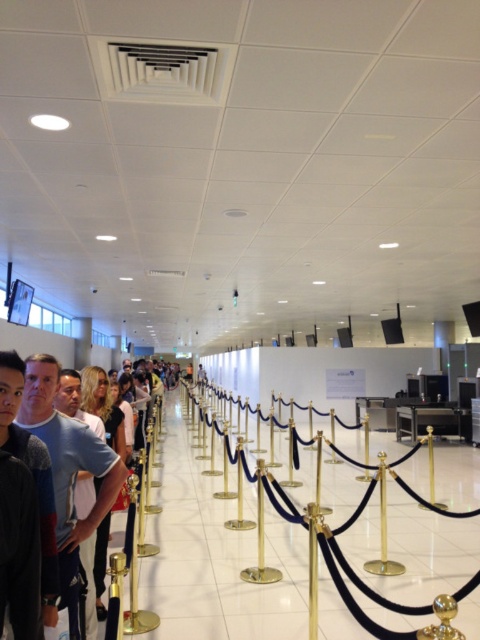
You are standing in the airport corridor and see two points marked on the floor. Which point is closer to you, point (x=106, y=452) or point (x=41, y=477)?

Point (x=106, y=452) is further to the viewer than point (x=41, y=477), so the closer point is point (x=41, y=477).

You are a photographer standing in the airport corridor. You want to take a photo that includes both the matte blue shirt at center and the gold polished ball at center. Which object should you focus on first to ensure both are in frame?

The matte blue shirt at center is much taller than the gold polished ball at center, so you should focus on the matte blue shirt at center first to ensure both are in frame.

You are a security guard in the airport. You need to check the width of the dark gray sweater at center and the gold polished ball at center to ensure they fit through the metal detector. Which object is wider?

The dark gray sweater at center might be wider than gold polished ball at center, so it could be wider.